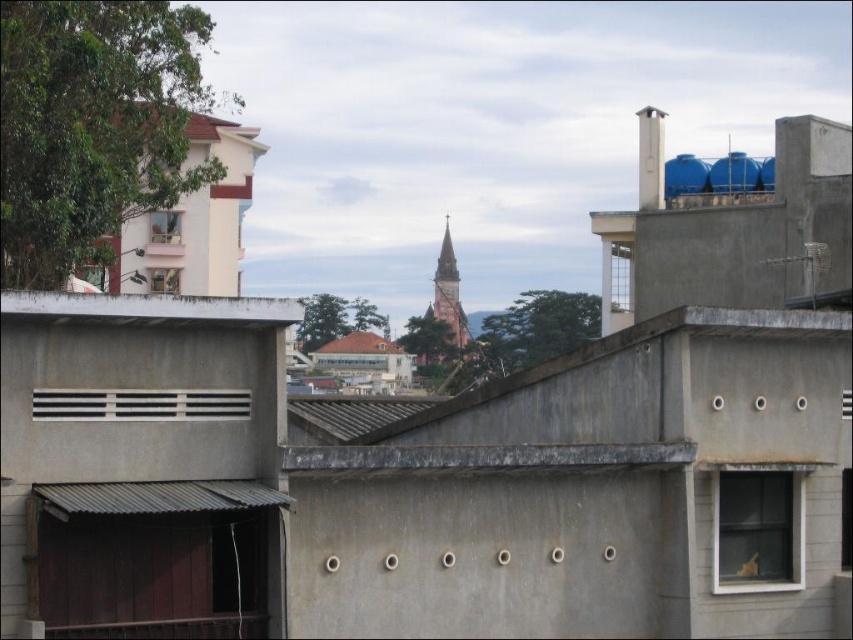
Question: Can you confirm if transparent glass window at lower right is smaller than clear glass window at upper left?

Choices:
 (A) no
 (B) yes

Answer: (A)

Question: Which point is closer to the camera?

Choices:
 (A) (167, 228)
 (B) (155, 284)
 (C) (751, 470)
 (D) (379, 342)

Answer: (C)

Question: In this image, where is red brick church steeple at center located relative to matte white window at upper left?

Choices:
 (A) below
 (B) above

Answer: (B)

Question: Which object is farther from the camera taking this photo?

Choices:
 (A) brown tiled roof at center
 (B) matte white window at upper left
 (C) transparent glass window at lower right

Answer: (A)

Question: Which is farther from the matte white window at upper left?

Choices:
 (A) red brick church steeple at center
 (B) brown tiled roof at center
 (C) transparent glass window at lower right
 (D) clear glass window at upper left

Answer: (A)

Question: Does transparent glass window at lower right appear under brown tiled roof at center?

Choices:
 (A) yes
 (B) no

Answer: (A)